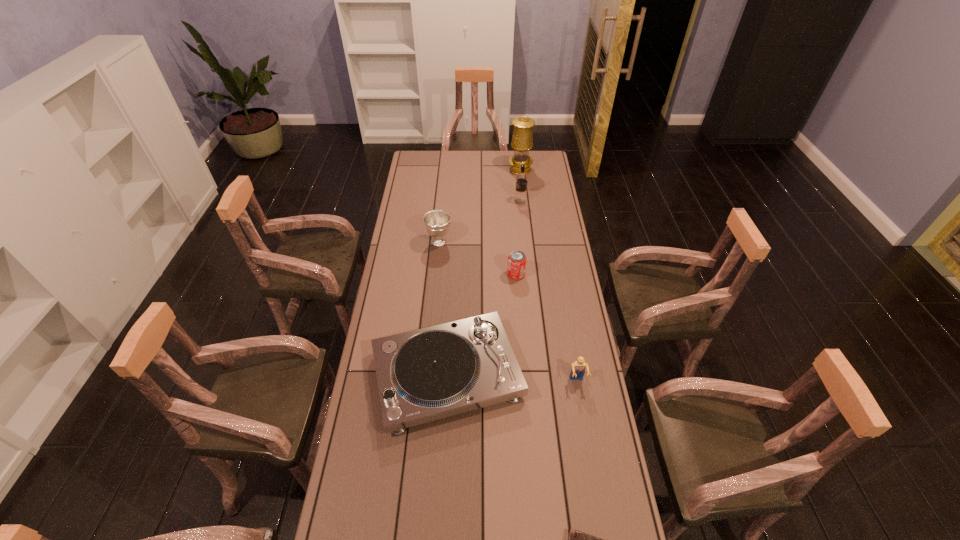
This screenshot has width=960, height=540. Identify the location of the tallest object. (522, 141).

Where is `the farthest object`? This screenshot has width=960, height=540. the farthest object is located at coordinates (522, 141).

This screenshot has width=960, height=540. I want to click on the second farthest object, so click(x=520, y=198).

Locate an element on the screen. the second tallest object is located at coordinates (520, 198).

Where is `the third tallest object`? The image size is (960, 540). the third tallest object is located at coordinates (437, 222).

This screenshot has height=540, width=960. I want to click on chalice, so click(437, 222).

Where is `Lego`? Image resolution: width=960 pixels, height=540 pixels. Lego is located at coordinates (578, 369).

Identify the location of record player. (427, 374).

Where is `the fourth nearest object`? This screenshot has height=540, width=960. the fourth nearest object is located at coordinates (516, 267).

Locate an element on the screen. The width and height of the screenshot is (960, 540). vacant space situated 0.400m on the left of the tallest object is located at coordinates (438, 170).